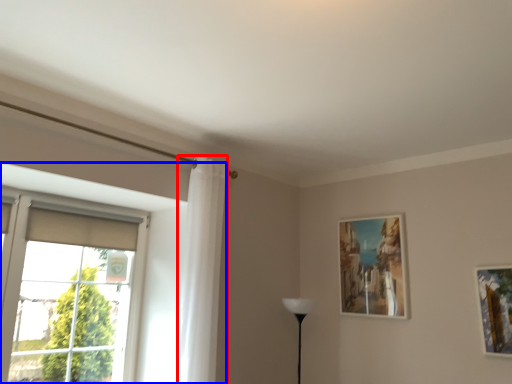
Question: Which point is closer to the camera, curtain (highlighted by a red box) or window (highlighted by a blue box)?

Choices:
 (A) curtain
 (B) window

Answer: (B)